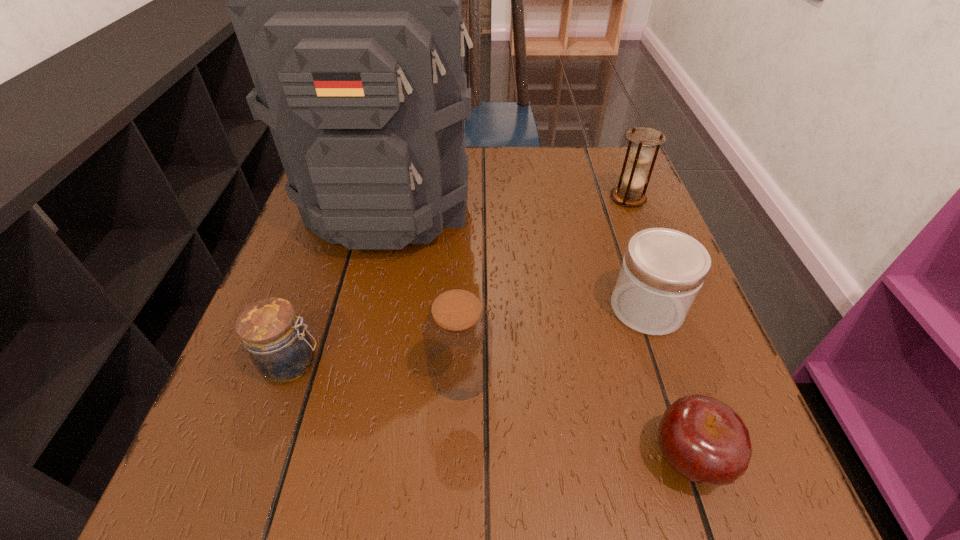
The width and height of the screenshot is (960, 540). I want to click on apple at the right edge, so click(x=705, y=441).

At what (x,y) coordinates should I click in order to perform the action: click on object that is at the far left corner. Please return your answer as a coordinate pair (x, y). Looking at the image, I should click on (346, 0).

Locate an element on the screen. object situated at the far right corner is located at coordinates (640, 155).

At what (x,y) coordinates should I click in order to perform the action: click on object that is at the near right corner. Please return your answer as a coordinate pair (x, y). Looking at the image, I should click on (705, 441).

Find the location of a particular element. The image size is (960, 540). free space at the far edge of the desktop is located at coordinates (562, 160).

You are a GUI agent. You are given a task and a screenshot of the screen. Output one action in this format:
    pyautogui.click(x=<x>, y=<y>)
    Task: Click on the vacant region at the left edge of the desktop
    
    Given the screenshot: What is the action you would take?
    pyautogui.click(x=211, y=439)

The width and height of the screenshot is (960, 540). Identify the location of vacant area at the near right corner. (751, 469).

Find the location of a particular element. This screenshot has height=540, width=960. vacant space in between the hourglass and the leftmost jar is located at coordinates (460, 281).

At what (x,y) coordinates should I click in order to perform the action: click on vacant area that lies between the rightmost jar and the second jar from right to left. Please return your answer as a coordinate pair (x, y). The height and width of the screenshot is (540, 960). Looking at the image, I should click on (554, 340).

Where is `vacant space in between the rightmost jar and the apple`? The width and height of the screenshot is (960, 540). vacant space in between the rightmost jar and the apple is located at coordinates (667, 382).